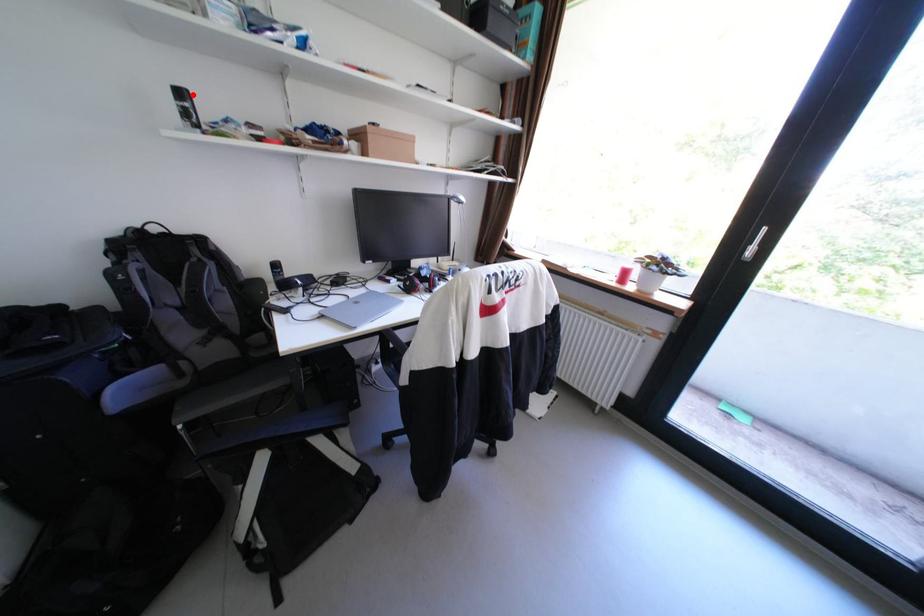
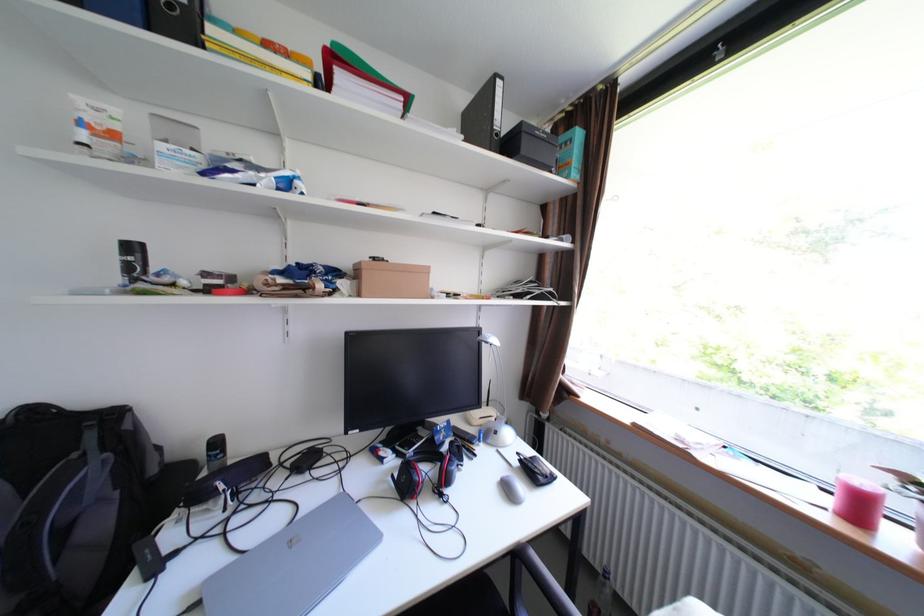
Find the pixel in the second image that matches the highlighted location in the first image.

(143, 248)